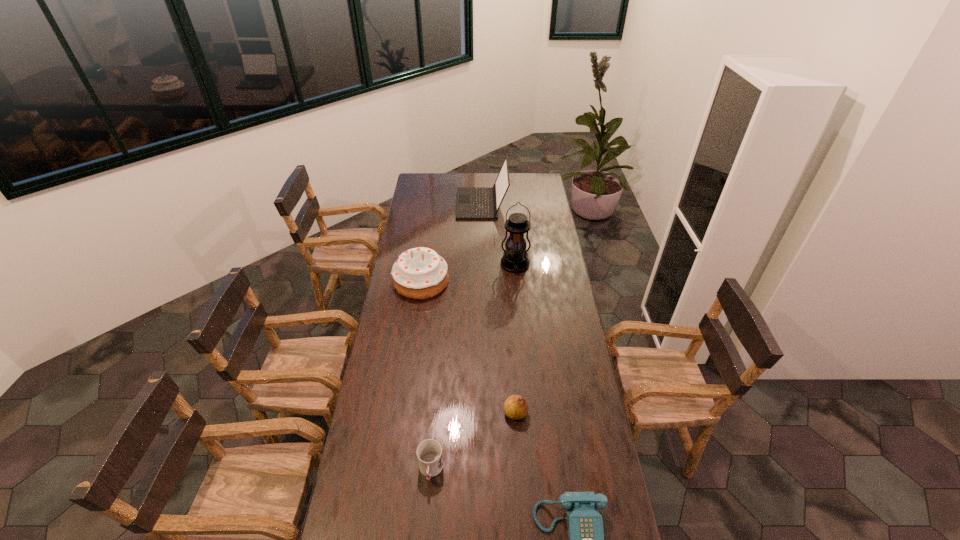
Locate an element on the screen. vacant area that lies between the tallest object and the third tallest object is located at coordinates (468, 273).

Where is `unoccupied area between the third tallest object and the lantern`? unoccupied area between the third tallest object and the lantern is located at coordinates (468, 273).

Locate an element on the screen. vacant area between the fourth shortest object and the laptop is located at coordinates (451, 242).

I want to click on vacant area that lies between the second nearest object and the fourth shortest object, so click(x=426, y=375).

Find the location of a particular element. The width and height of the screenshot is (960, 540). vacant area between the third shortest object and the cup is located at coordinates (473, 442).

The image size is (960, 540). Find the location of `vacant area that lies between the third shortest object and the second tallest object`. vacant area that lies between the third shortest object and the second tallest object is located at coordinates click(x=498, y=308).

Find the location of a particular element. empty space that is in between the fourth shortest object and the cup is located at coordinates (426, 375).

Locate an element on the screen. This screenshot has height=540, width=960. blank region between the fourth farthest object and the lantern is located at coordinates (516, 339).

The width and height of the screenshot is (960, 540). Find the location of `vacant area that lies between the third shortest object and the tallest object`. vacant area that lies between the third shortest object and the tallest object is located at coordinates (516, 339).

Where is `object that is the third closest to the fourth tallest object`? This screenshot has height=540, width=960. object that is the third closest to the fourth tallest object is located at coordinates (420, 273).